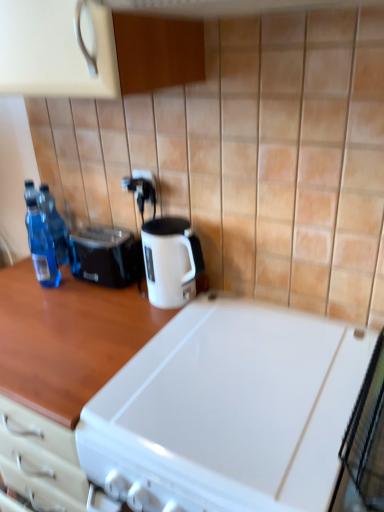
I want to click on blank space above white glossy countertop at upper left, arranged as the first countertop when viewed from the right (from a real-world perspective), so click(x=247, y=368).